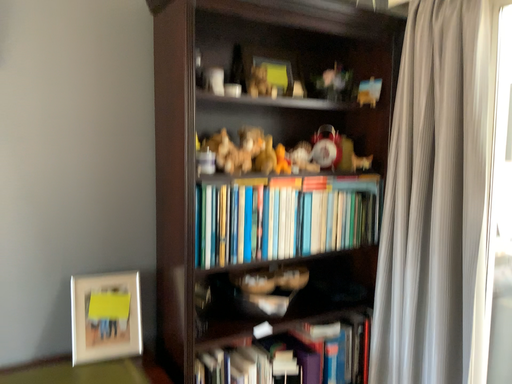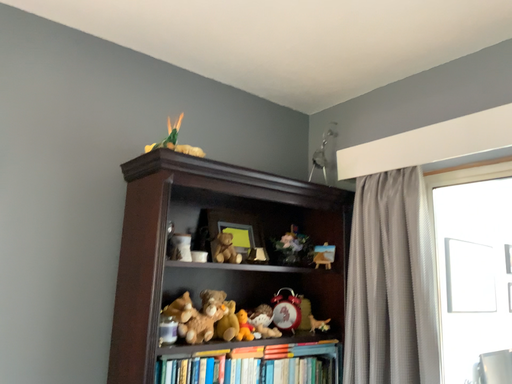
Question: How did the camera likely rotate when shooting the video?

Choices:
 (A) rotated upward
 (B) rotated downward

Answer: (A)